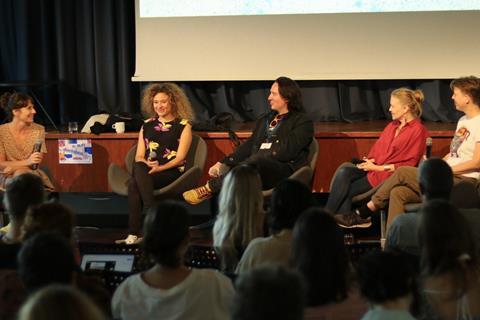
You are a GUI agent. You are given a task and a screenshot of the screen. Output one action in this format:
    pyautogui.click(x=<x>, y=<y>)
    Task: Click on the panel
    The image size is (480, 320).
    Given the screenshot: What is the action you would take?
    pyautogui.click(x=280, y=128)